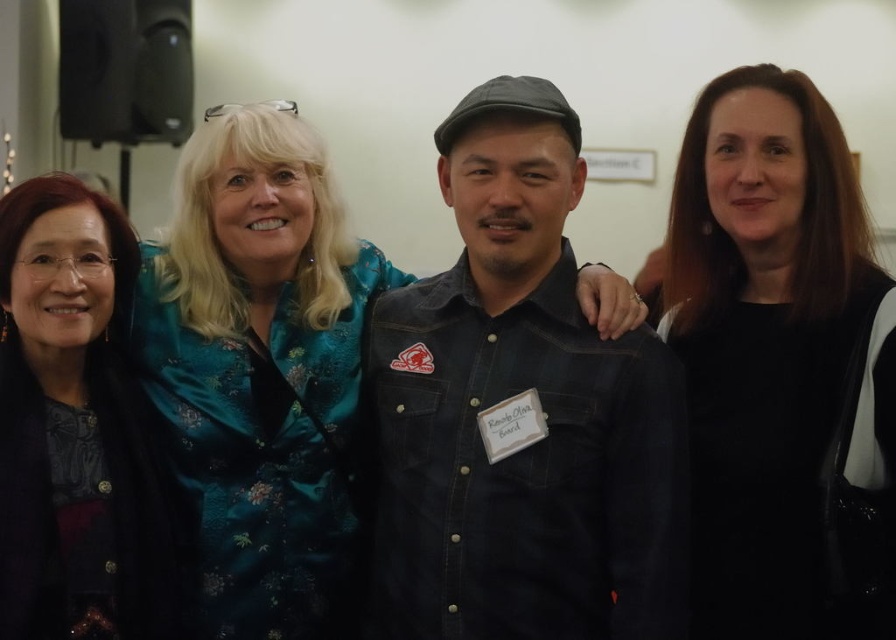
Does denim shirt at center appear over matte black jacket at left?

Yes, denim shirt at center is above matte black jacket at left.

The height and width of the screenshot is (640, 896). Find the location of `denim shirt at center`. denim shirt at center is located at coordinates (511, 397).

Can you confirm if black matte dress at center is positioned below matte black jacket at left?

No, black matte dress at center is not below matte black jacket at left.

Between black matte dress at center and matte black jacket at left, which one appears on the left side from the viewer's perspective?

matte black jacket at left

Does point (722, 253) come in front of point (39, 506)?

No, (722, 253) is further to viewer.

Locate an element on the screen. This screenshot has width=896, height=640. black matte dress at center is located at coordinates (782, 365).

Is denim shirt at center wider than black matte dress at center?

Correct, the width of denim shirt at center exceeds that of black matte dress at center.

Locate an element on the screen. This screenshot has height=640, width=896. denim shirt at center is located at coordinates (511, 397).

Between point (548, 148) and point (765, 634), which one is positioned in front?

Point (765, 634) is in front.

This screenshot has height=640, width=896. I want to click on denim shirt at center, so click(x=511, y=397).